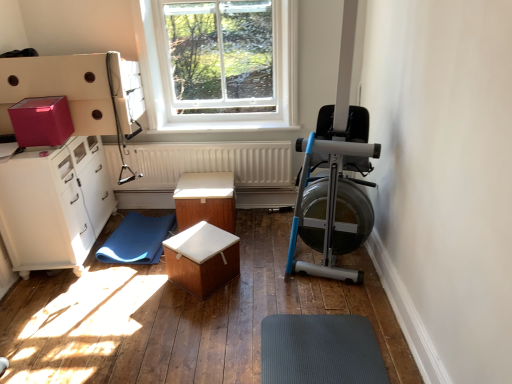
Question: From the image's perspective, is white textured radiator at center located above or below wooden box at center, which is the first table from back to front?

Choices:
 (A) above
 (B) below

Answer: (A)

Question: Considering the positions of white textured radiator at center and wooden box at center, the second table when ordered from front to back, in the image, is white textured radiator at center bigger or smaller than wooden box at center, the second table when ordered from front to back,?

Choices:
 (A) big
 (B) small

Answer: (B)

Question: Based on their relative distances, which object is farther from the clear glass window at upper center?

Choices:
 (A) wooden box at center, the first table in the front-to-back sequence
 (B) matte pink cardboard box at upper left
 (C) blue rubber mat at lower left
 (D) wooden box at center, which is the first table from back to front
 (E) white glossy cabinet at left

Answer: (A)

Question: Which of these objects is positioned closest to the wooden box at center, which is the first table from back to front?

Choices:
 (A) matte pink cardboard box at upper left
 (B) clear glass window at upper center
 (C) wooden box at center, arranged as the second table when viewed from the back
 (D) blue rubber mat at lower left
 (E) white textured radiator at center

Answer: (E)